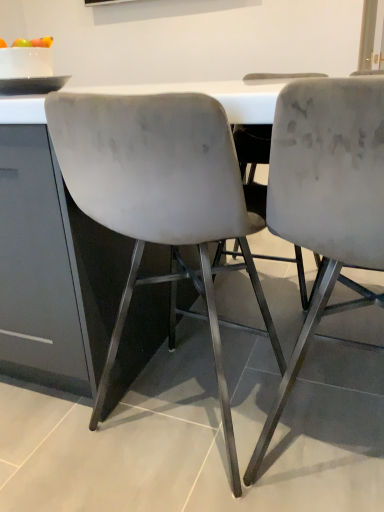
Question: Would you say velvet gray chair at center, the 1th chair in the right-to-left sequence, is to the left or to the right of matte gray chair at center, the 1th chair positioned from the left, in the picture?

Choices:
 (A) right
 (B) left

Answer: (A)

Question: Considering the positions of point (327, 132) and point (228, 456), is point (327, 132) closer or farther from the camera than point (228, 456)?

Choices:
 (A) farther
 (B) closer

Answer: (B)

Question: Would you say velvet gray chair at center, which ranks as the 2th chair in left-to-right order, is inside or outside matte gray chair at center, positioned as the 2th chair in right-to-left order?

Choices:
 (A) outside
 (B) inside

Answer: (A)

Question: Is matte gray chair at center, the 1th chair positioned from the left, bigger or smaller than velvet gray chair at center, which ranks as the 2th chair in left-to-right order?

Choices:
 (A) small
 (B) big

Answer: (B)

Question: From the image's perspective, is matte gray chair at center, positioned as the 2th chair in right-to-left order, above or below velvet gray chair at center, the 1th chair in the right-to-left sequence?

Choices:
 (A) below
 (B) above

Answer: (B)

Question: Do you think matte gray chair at center, positioned as the 2th chair in right-to-left order, is within velvet gray chair at center, which ranks as the 2th chair in left-to-right order, or outside of it?

Choices:
 (A) inside
 (B) outside

Answer: (B)

Question: From a real-world perspective, relative to velvet gray chair at center, the 1th chair in the right-to-left sequence, is matte gray chair at center, positioned as the 2th chair in right-to-left order, vertically above or below?

Choices:
 (A) above
 (B) below

Answer: (A)